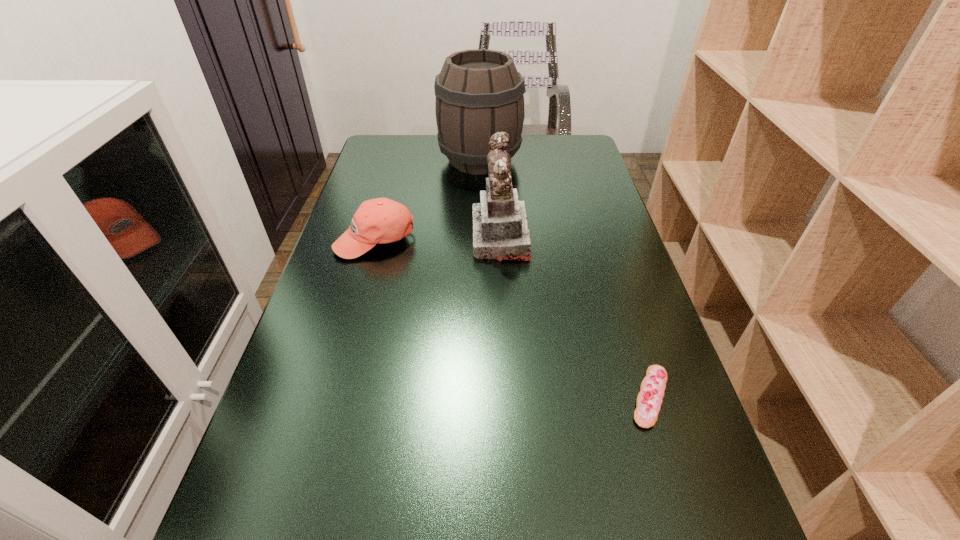
At what (x,y) coordinates should I click in order to perform the action: click on the farthest object. Please return your answer as a coordinate pair (x, y). This screenshot has width=960, height=540. Looking at the image, I should click on (479, 92).

In order to click on figurine in this screenshot , I will do `click(500, 230)`.

What are the coordinates of `the second shortest object` in the screenshot? It's located at (381, 220).

The width and height of the screenshot is (960, 540). Find the location of `the leftmost object`. the leftmost object is located at coordinates (381, 220).

The height and width of the screenshot is (540, 960). In order to click on the shortest object in this screenshot , I will do `click(649, 400)`.

Where is `eclair`? eclair is located at coordinates (649, 400).

Where is `vacant region located on the front of the farthest object`? This screenshot has width=960, height=540. vacant region located on the front of the farthest object is located at coordinates (479, 215).

This screenshot has width=960, height=540. I want to click on free region located on the front-facing side of the second tallest object, so click(438, 237).

Identify the location of free space located on the front-facing side of the second tallest object. (453, 237).

Identify the location of free space located 0.250m on the front-facing side of the second tallest object. The width and height of the screenshot is (960, 540). (377, 237).